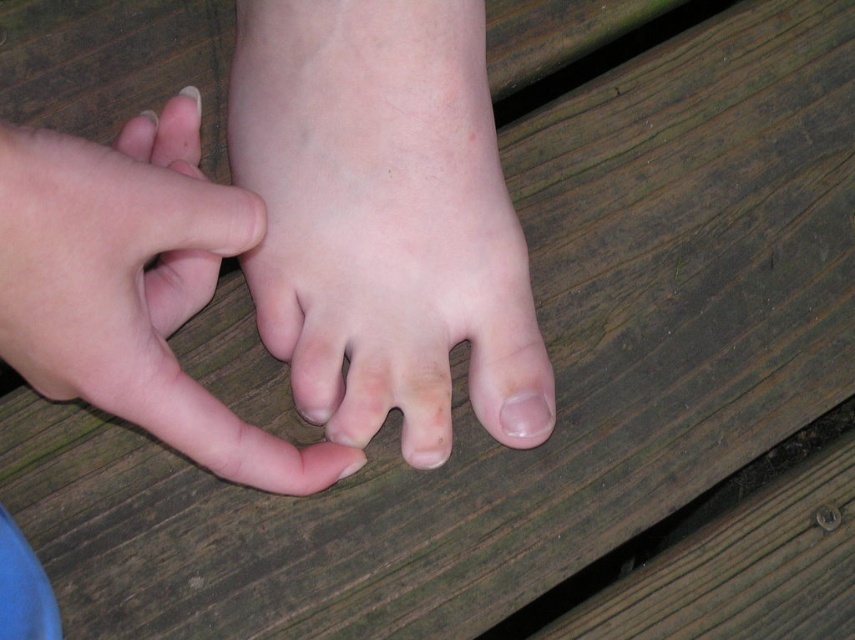
Question: Is smooth skin hand at center thinner than pale skin toe at center?

Choices:
 (A) no
 (B) yes

Answer: (A)

Question: Observing the image, what is the correct spatial positioning of pale skin foot at center in reference to smooth pink nail at center?

Choices:
 (A) above
 (B) below

Answer: (A)

Question: Which object is positioned farthest from the pale skin toe at center?

Choices:
 (A) pale skin foot at center
 (B) smooth skin hand at center
 (C) smooth pink nail at center

Answer: (C)

Question: Considering the real-world distances, which object is farthest from the pale skin foot at center?

Choices:
 (A) pale skin toe at center
 (B) smooth pink nail at center
 (C) smooth skin hand at center

Answer: (A)

Question: Considering the real-world distances, which object is closest to the smooth pink nail at center?

Choices:
 (A) pale skin toe at center
 (B) smooth skin hand at center

Answer: (B)

Question: Is smooth pink nail at center thinner than pale skin toe at center?

Choices:
 (A) yes
 (B) no

Answer: (B)